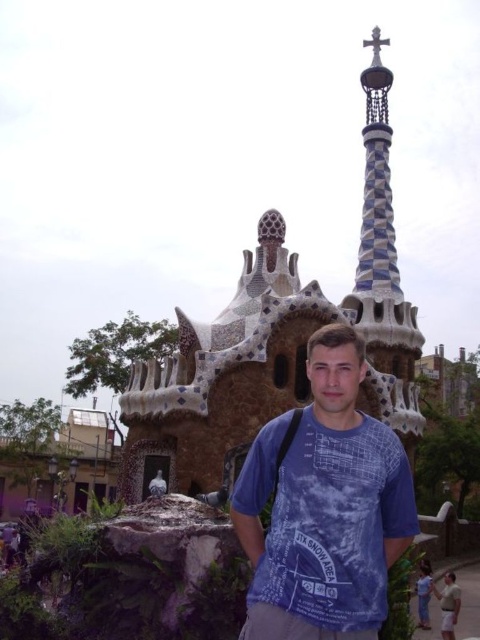
You are taking a photo of the architectural structure at Park Guell and want to ensure both the intricate mosaics on the facade and the rounded dome with honeycomb pattern are in focus. You notice two points marked as point 1 at coordinates (252, 458) and point 2 at coordinates (439, 600). Which point should you focus on to capture both elements clearly?

You should focus on point 1 at coordinates (252, 458) because it is closer to the camera than point 2 at coordinates (439, 600). By focusing on the closer point, the depth of field will extend further, potentially keeping both points in focus.

You are standing at the base of the tall tower in the Park Guell structure and see two points marked in the image. One is labeled as point (x=359, y=536) and the other as point (x=373, y=196). Which point is closer to you?

Point (x=359, y=536) is in front of point (x=373, y=196), so it is closer to you.